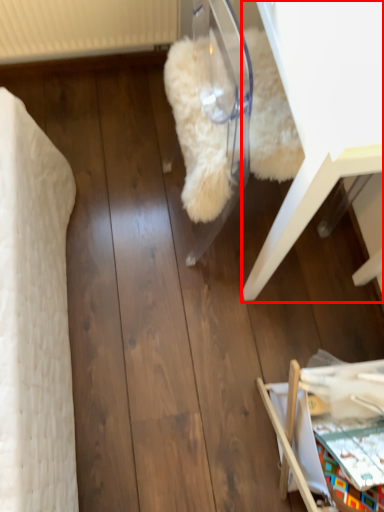
Question: Where is furniture (annotated by the red box) located in relation to furniture in the image?

Choices:
 (A) left
 (B) right

Answer: (A)